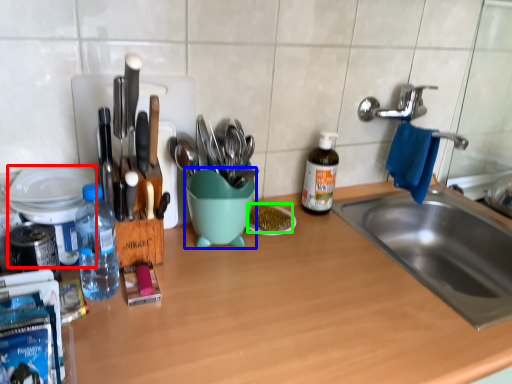
Question: Based on their relative distances, which object is farther from appliance (highlighted by a red box)? Choose from mixing bowl (highlighted by a blue box) and food (highlighted by a green box).

Choices:
 (A) mixing bowl
 (B) food

Answer: (B)